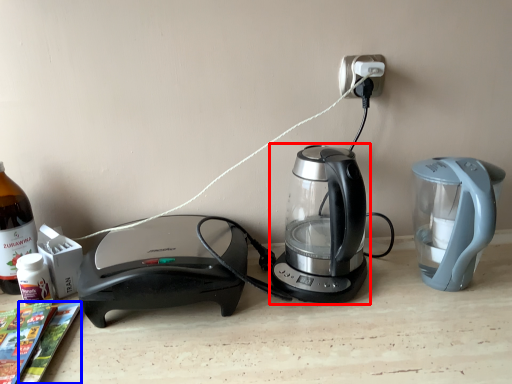
Question: Which object appears closest to the camera in this image, kettle (highlighted by a red box) or magazine (highlighted by a blue box)?

Choices:
 (A) kettle
 (B) magazine

Answer: (B)